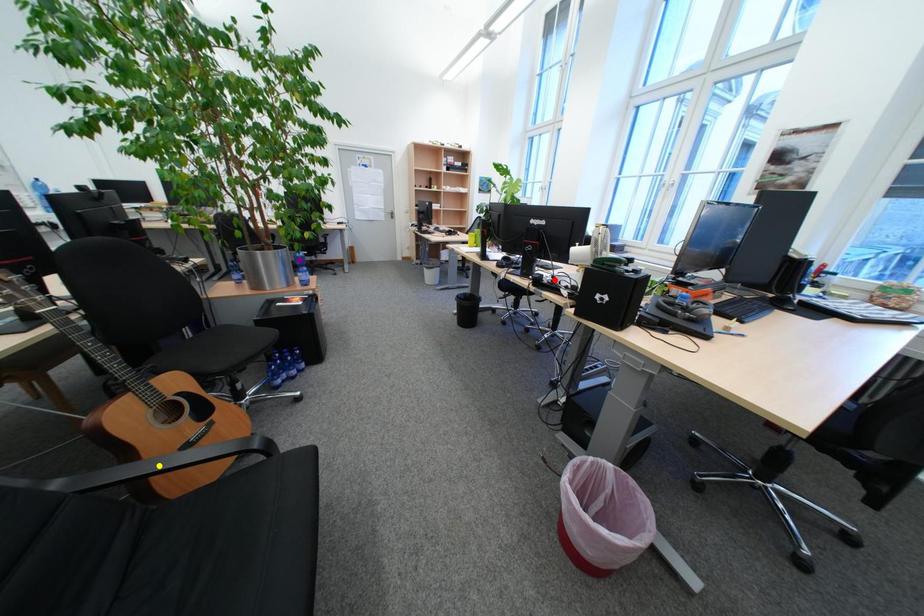
Order these from nearest to farthest:
purple point | red point | yellow point

yellow point → red point → purple point